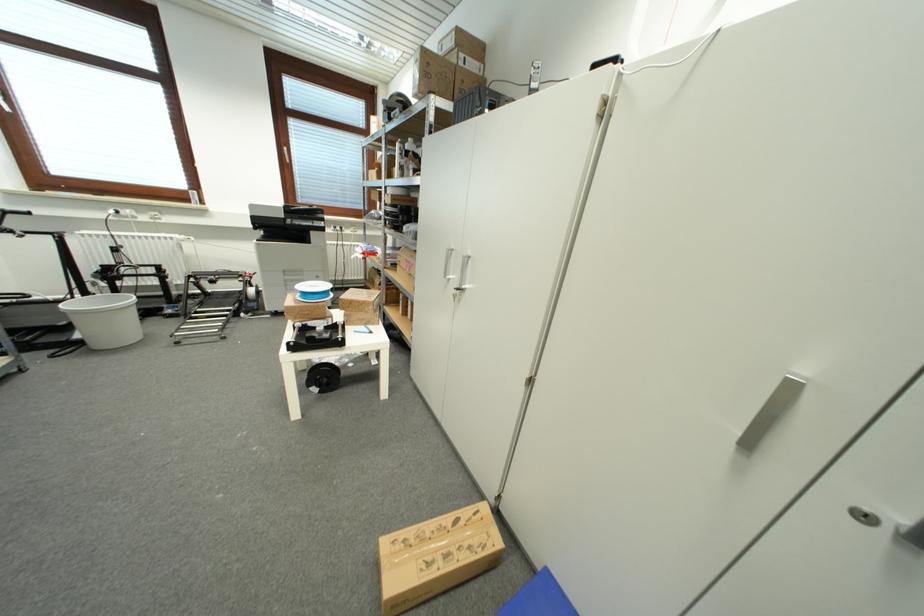
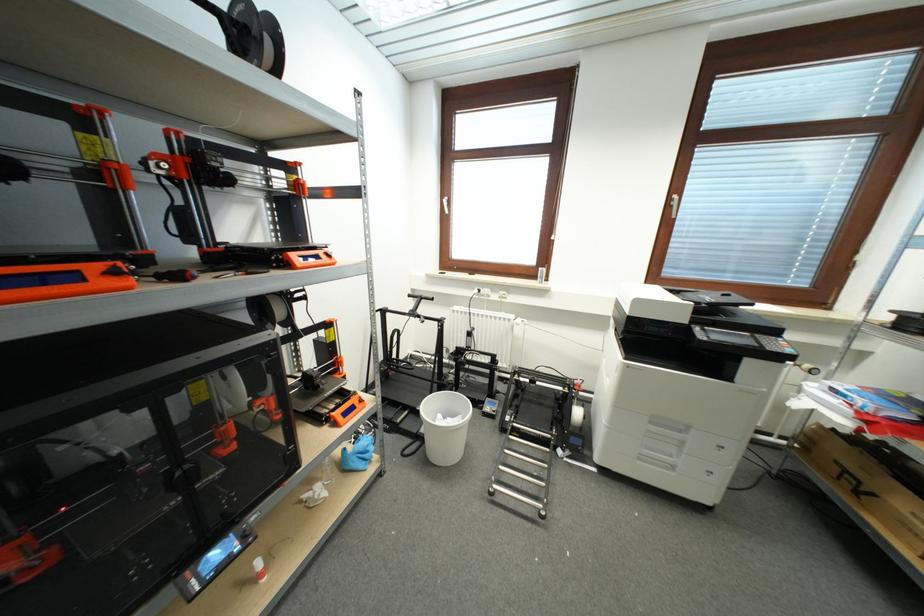
Where in the second image is the point corresponding to (80,339) from the first image?

(427, 434)